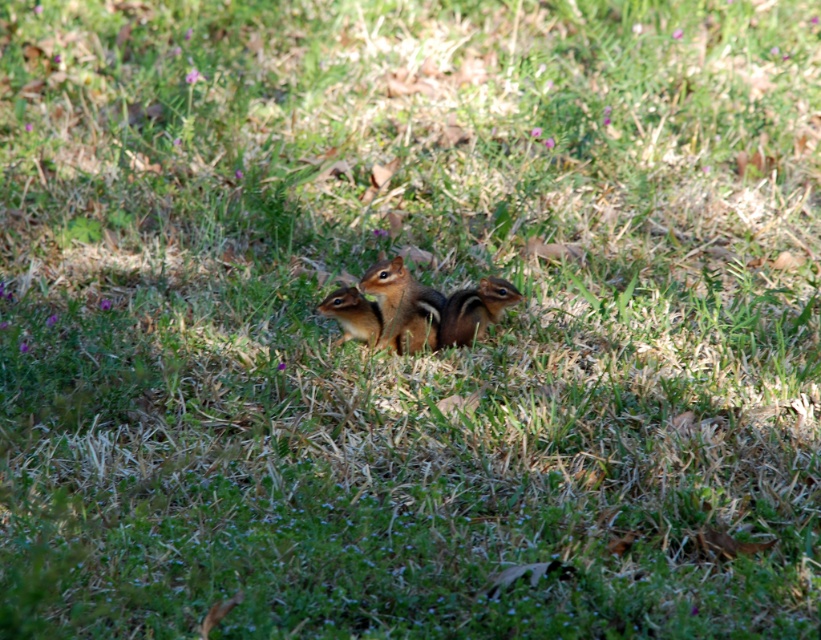
Which is in front, point (424, 298) or point (479, 312)?

Point (424, 298) is in front.

Looking at this image, measure the distance between point (381, 333) and camera.

They are 12.25 feet apart.

Is point (395, 339) positioned in front of point (493, 285)?

No, (395, 339) is further to viewer.

Identify the location of brown furry squirrel at center. Image resolution: width=821 pixels, height=640 pixels. coord(402,305).

Between brown furry squirrel at center and golden-brown fur squirrel at center, which one is positioned higher?

brown furry squirrel at center

Is brown furry squirrel at center taller than golden-brown fur squirrel at center?

Correct, brown furry squirrel at center is much taller as golden-brown fur squirrel at center.

Between point (383, 296) and point (360, 296), which one is positioned behind?

The point (360, 296) is more distant.

Locate an element on the screen. brown furry squirrel at center is located at coordinates (402, 305).

Between shiny brown squirrel at center and golden-brown fur squirrel at center, which one appears on the right side from the viewer's perspective?

From the viewer's perspective, shiny brown squirrel at center appears more on the right side.

Can you confirm if shiny brown squirrel at center is positioned below golden-brown fur squirrel at center?

No.

Which is in front, point (466, 320) or point (370, 328)?

Point (466, 320) is more forward.

Locate an element on the screen. This screenshot has width=821, height=640. shiny brown squirrel at center is located at coordinates (475, 310).